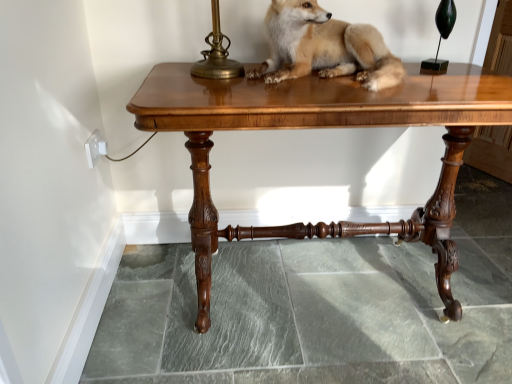
Locate an element on the screen. vacant space underneath light brown fur at center (from a real-world perspective) is located at coordinates (329, 81).